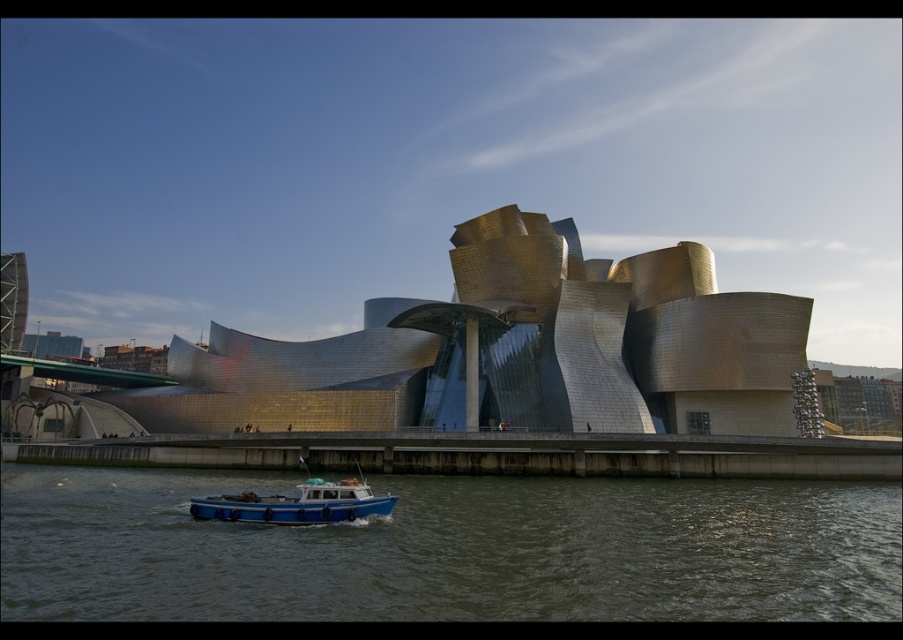
Question: Which point appears closest to the camera in this image?

Choices:
 (A) (243, 488)
 (B) (219, 516)

Answer: (B)

Question: Which of the following is the closest to the observer?

Choices:
 (A) (371, 534)
 (B) (309, 506)

Answer: (B)

Question: Among these objects, which one is farthest from the camera?

Choices:
 (A) dark green water at lower center
 (B) blue matte boat at lower center

Answer: (B)

Question: Does dark green water at lower center appear under blue matte boat at lower center?

Choices:
 (A) no
 (B) yes

Answer: (B)

Question: Is dark green water at lower center behind blue matte boat at lower center?

Choices:
 (A) yes
 (B) no

Answer: (B)

Question: Does dark green water at lower center appear under blue matte boat at lower center?

Choices:
 (A) no
 (B) yes

Answer: (B)